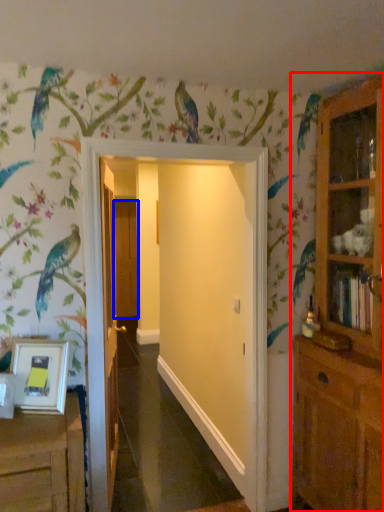
Question: Which object is further to the camera taking this photo, cupboard (highlighted by a red box) or door (highlighted by a blue box)?

Choices:
 (A) cupboard
 (B) door

Answer: (B)